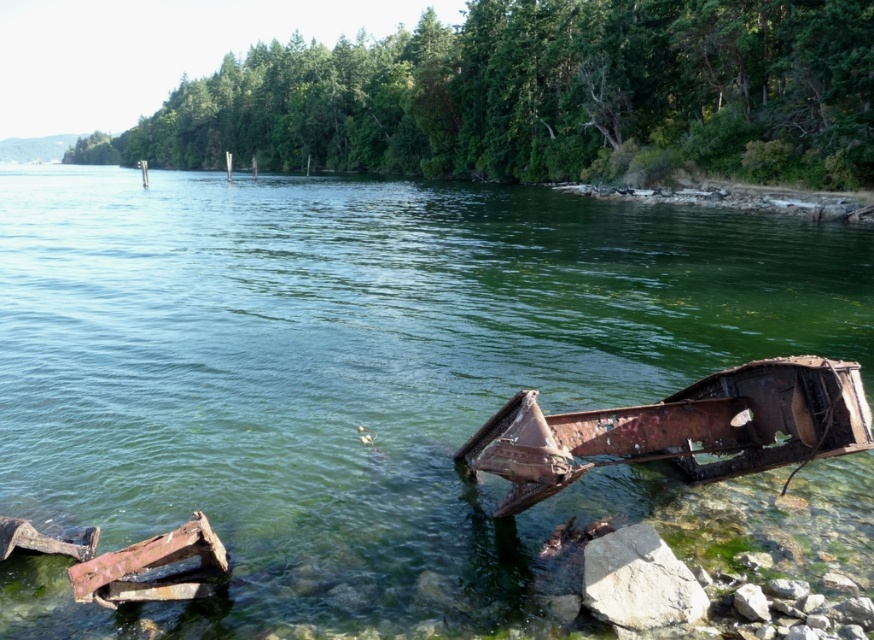
Is green rusty metal car at lower right in front of rusty metal boat at lower right?

No, green rusty metal car at lower right is further to the viewer.

Which is more to the left, green rusty metal car at lower right or rusty metal boat at lower right?

green rusty metal car at lower right is more to the left.

I want to click on green rusty metal car at lower right, so click(383, 385).

Does green rusty metal car at lower right have a smaller size compared to gray rough rock at lower right?

No.

Between point (838, 524) and point (595, 611), which one is positioned in front?

Point (595, 611) is in front.

Locate an element on the screen. green rusty metal car at lower right is located at coordinates (383, 385).

Does rusty metal boat at lower right appear under gray rough rock at lower right?

No.

Which is behind, point (685, 444) or point (600, 579)?

Positioned behind is point (685, 444).

The image size is (874, 640). Find the location of `rusty metal boat at lower right`. rusty metal boat at lower right is located at coordinates (680, 428).